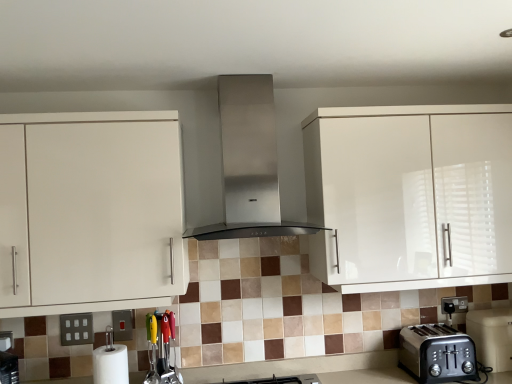
Measure the distance between brushed metal switch at lower left and camera.

1.97 meters.

Identify the location of matte black toaster at lower right. (437, 353).

The height and width of the screenshot is (384, 512). What are the coordinates of `multicolored plastic utensils at lower center, which is the 2th appliance from right to left` in the screenshot? It's located at (161, 349).

Are brushed metal switch at lower left and stainless steel range hood at center making contact?

There is a gap between brushed metal switch at lower left and stainless steel range hood at center.

Identify the location of square on the left of stainless steel range hood at center. click(122, 325).

From the image's perspective, is brushed metal switch at lower left under stainless steel range hood at center?

Yes, from the image's perspective, brushed metal switch at lower left is beneath stainless steel range hood at center.

Is point (501, 224) in front of point (61, 329)?

Yes, it is.

The image size is (512, 384). In order to click on electric outlet located below the glossy white cabinet at upper right, the second cabinetry in the left-to-right sequence (from the image's perspective) in this screenshot , I will do `click(76, 329)`.

From their relative heights in the image, would you say glossy white cabinet at upper right, the second cabinetry in the left-to-right sequence, is taller or shorter than satin silver outlet at lower left?

Clearly, glossy white cabinet at upper right, the second cabinetry in the left-to-right sequence, is taller compared to satin silver outlet at lower left.

Which object is wider, brushed metal switch at lower left or matte black toaster at lower right?

matte black toaster at lower right is wider.

Considering the relative sizes of brushed metal switch at lower left and matte black toaster at lower right in the image provided, is brushed metal switch at lower left taller than matte black toaster at lower right?

→ In fact, brushed metal switch at lower left may be shorter than matte black toaster at lower right.

Could you tell me if brushed metal switch at lower left is facing matte black toaster at lower right?

No, brushed metal switch at lower left does not turn towards matte black toaster at lower right.

Considering the positions of objects brushed metal switch at lower left and matte black toaster at lower right in the image provided, who is more to the right, brushed metal switch at lower left or matte black toaster at lower right?

Positioned to the right is matte black toaster at lower right.

Is brushed metal switch at lower left inside multicolored plastic utensils at lower center, positioned as the first appliance in left-to-right order?

No.

Which is more distant, (156,321) or (123,338)?

The point (123,338) is more distant.

Is multicolored plastic utensils at lower center, which is counted as the first appliance, starting from the front, touching brushed metal switch at lower left?

They are not placed beside each other.

The height and width of the screenshot is (384, 512). What are the coordinates of `cabinetry in front of the glossy white cabinet at upper right, the second cabinetry in the left-to-right sequence` in the screenshot? It's located at (91, 211).

Is white glossy cabinet at left, the 1th cabinetry positioned from the left, looking in the opposite direction of glossy white cabinet at upper right, the first cabinetry from the right?

No, white glossy cabinet at left, the 1th cabinetry positioned from the left,'s orientation is not away from glossy white cabinet at upper right, the first cabinetry from the right.

Is white glossy cabinet at left, the 1th cabinetry positioned from the left, positioned far away from glossy white cabinet at upper right, the second cabinetry in the left-to-right sequence?

No, white glossy cabinet at left, the 1th cabinetry positioned from the left, is not far away from glossy white cabinet at upper right, the second cabinetry in the left-to-right sequence.

In the scene shown: From a real-world perspective, is white glossy cabinet at left, the 1th cabinetry positioned from the left, physically above glossy white cabinet at upper right, the second cabinetry in the left-to-right sequence?

Yes, from a real-world perspective, white glossy cabinet at left, the 1th cabinetry positioned from the left, is on top of glossy white cabinet at upper right, the second cabinetry in the left-to-right sequence.

Is stainless steel range hood at center inside or outside of white glossy cabinet at left, arranged as the 2th cabinetry when viewed from the right?

stainless steel range hood at center is outside white glossy cabinet at left, arranged as the 2th cabinetry when viewed from the right.

From the image's perspective, would you say stainless steel range hood at center is positioned over white glossy cabinet at left, the 1th cabinetry positioned from the left?

Yes.

From a real-world perspective, which object stands above the other?

stainless steel range hood at center is physically above.

Is stainless steel range hood at center to the right of white glossy cabinet at left, the 1th cabinetry positioned from the left, from the viewer's perspective?

Correct, you'll find stainless steel range hood at center to the right of white glossy cabinet at left, the 1th cabinetry positioned from the left.

In the scene shown: Would you say glossy white cabinet at upper right, the second cabinetry in the left-to-right sequence, is inside or outside black plastic toaster at lower right, the 2th appliance from the left?

glossy white cabinet at upper right, the second cabinetry in the left-to-right sequence, lies outside black plastic toaster at lower right, the 2th appliance from the left.

From the picture: Considering the sizes of objects glossy white cabinet at upper right, the second cabinetry in the left-to-right sequence, and black plastic toaster at lower right, arranged as the first appliance when viewed from the back, in the image provided, who is taller, glossy white cabinet at upper right, the second cabinetry in the left-to-right sequence, or black plastic toaster at lower right, arranged as the first appliance when viewed from the back,?

Standing taller between the two is glossy white cabinet at upper right, the second cabinetry in the left-to-right sequence.

In the image, is glossy white cabinet at upper right, the second cabinetry in the left-to-right sequence, positioned in front of or behind black plastic toaster at lower right, the first appliance from the right?

glossy white cabinet at upper right, the second cabinetry in the left-to-right sequence, is in front of black plastic toaster at lower right, the first appliance from the right.

Is glossy white cabinet at upper right, the first cabinetry from the right, not close to black plastic toaster at lower right, arranged as the first appliance when viewed from the back?

glossy white cabinet at upper right, the first cabinetry from the right, is actually quite close to black plastic toaster at lower right, arranged as the first appliance when viewed from the back.

Find the location of a particular element. The image size is (512, 384). home appliance on the right of the brushed metal switch at lower left is located at coordinates (249, 163).

Locate an element on the screen. electric outlet below the glossy white cabinet at upper right, the second cabinetry in the left-to-right sequence (from a real-world perspective) is located at coordinates (76, 329).

From the image, which object appears to be farther from glossy white cabinet at upper right, the first cabinetry from the right, multicolored plastic utensils at lower center, positioned as the first appliance in left-to-right order, or brushed metal switch at lower left?

brushed metal switch at lower left is positioned further to the anchor glossy white cabinet at upper right, the first cabinetry from the right.

Which object lies further to the anchor point black plastic toaster at lower right, placed as the 2th appliance when sorted from front to back, matte black toaster at lower right or satin silver outlet at lower left?

satin silver outlet at lower left lies further to black plastic toaster at lower right, placed as the 2th appliance when sorted from front to back, than the other object.

Estimate the real-world distances between objects in this image. Which object is closer to multicolored plastic utensils at lower center, positioned as the first appliance in left-to-right order, white matte paper towel at lower left or glossy white cabinet at upper right, the first cabinetry from the right?

The object closer to multicolored plastic utensils at lower center, positioned as the first appliance in left-to-right order, is white matte paper towel at lower left.

From the image, which object appears to be farther from glossy white cabinet at upper right, the first cabinetry from the right, stainless steel range hood at center or multicolored plastic utensils at lower center, which is counted as the first appliance, starting from the front?

Among the two, multicolored plastic utensils at lower center, which is counted as the first appliance, starting from the front, is located further to glossy white cabinet at upper right, the first cabinetry from the right.

Looking at the image, which one is located closer to black plastic toaster at lower right, the 2th appliance from the left, white matte paper towel at lower left or satin silver outlet at lower left?

white matte paper towel at lower left is closer to black plastic toaster at lower right, the 2th appliance from the left.

Considering their positions, is black plastic toaster at lower right, the first appliance from the right, positioned closer to white glossy cabinet at left, the 1th cabinetry positioned from the left, than brushed metal switch at lower left?

Based on the image, brushed metal switch at lower left appears to be nearer to white glossy cabinet at left, the 1th cabinetry positioned from the left.

Based on their spatial positions, is matte black toaster at lower right or white matte paper towel at lower left further from multicolored plastic utensils at lower center, positioned as the 2th appliance in back-to-front order?

matte black toaster at lower right is further to multicolored plastic utensils at lower center, positioned as the 2th appliance in back-to-front order.

Which object lies further to the anchor point black plastic toaster at lower right, the 2th appliance from the left, white matte paper towel at lower left or glossy white cabinet at upper right, the second cabinetry in the left-to-right sequence?

white matte paper towel at lower left is positioned further to the anchor black plastic toaster at lower right, the 2th appliance from the left.

Where is `appliance between white matte paper towel at lower left and black plastic toaster at lower right, arranged as the first appliance when viewed from the back, in the horizontal direction`? appliance between white matte paper towel at lower left and black plastic toaster at lower right, arranged as the first appliance when viewed from the back, in the horizontal direction is located at coordinates (161, 349).

In order to click on cabinetry between white matte paper towel at lower left and matte black toaster at lower right from left to right in this screenshot , I will do `click(410, 195)`.

The width and height of the screenshot is (512, 384). I want to click on toaster between stainless steel range hood at center and black plastic toaster at lower right, placed as the 2th appliance when sorted from front to back, from left to right, so click(437, 353).

Find the location of a particular element. The image size is (512, 384). paper towel situated between satin silver outlet at lower left and matte black toaster at lower right from left to right is located at coordinates (110, 365).